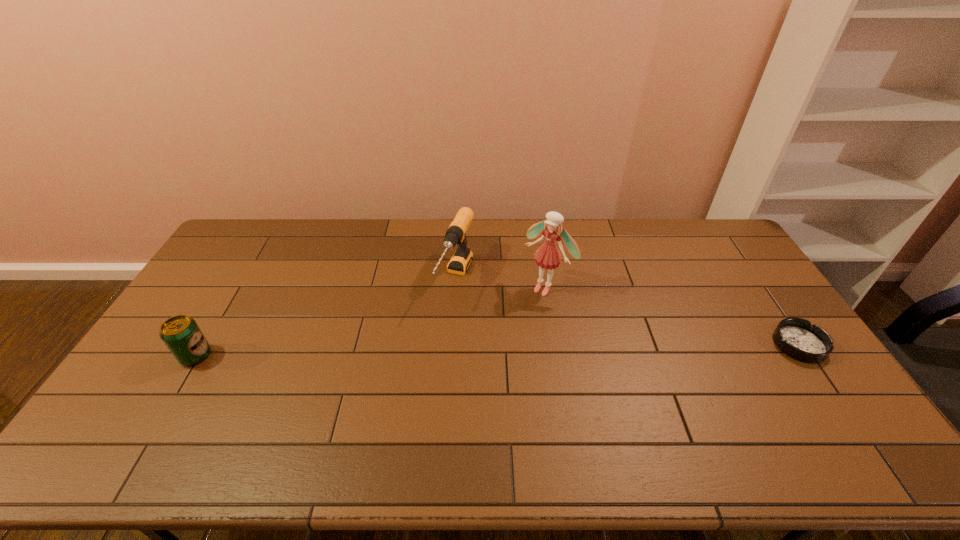
I want to click on vacant region between the drill and the leftmost object, so click(325, 317).

Locate an element on the screen. The height and width of the screenshot is (540, 960). blank region between the third object from left to right and the beer can is located at coordinates [371, 321].

Identify the location of empty space that is in between the drill and the ashtray. This screenshot has height=540, width=960. (628, 312).

Identify which object is located as the nearest to the second tallest object. Please provide its 2D coordinates. Your answer should be formatted as a tuple, i.e. [(x, y)], where the tuple contains the x and y coordinates of a point satisfying the conditions above.

[(547, 256)]

You are a GUI agent. You are given a task and a screenshot of the screen. Output one action in this format:
    pyautogui.click(x=<x>, y=<y>)
    Task: Click on the third closest object to the doll
    The image size is (960, 540).
    Given the screenshot: What is the action you would take?
    pyautogui.click(x=181, y=334)

Image resolution: width=960 pixels, height=540 pixels. Find the location of `vacant area that satisfies the following two spatial constraints: 1. on the back side of the second shortest object; 2. on the left side of the ashtray`. vacant area that satisfies the following two spatial constraints: 1. on the back side of the second shortest object; 2. on the left side of the ashtray is located at coordinates (203, 345).

I want to click on free space that satisfies the following two spatial constraints: 1. on the back side of the third tallest object; 2. on the right side of the second object from right to left, so click(x=236, y=287).

Identify the location of blank space that satisfies the following two spatial constraints: 1. on the front side of the shortest object; 2. on the left side of the drill. (452, 345).